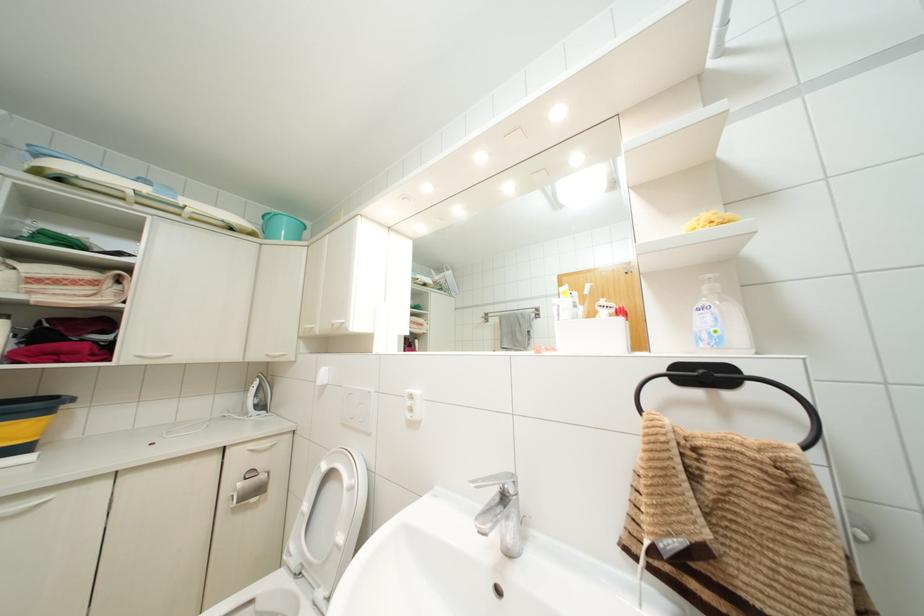
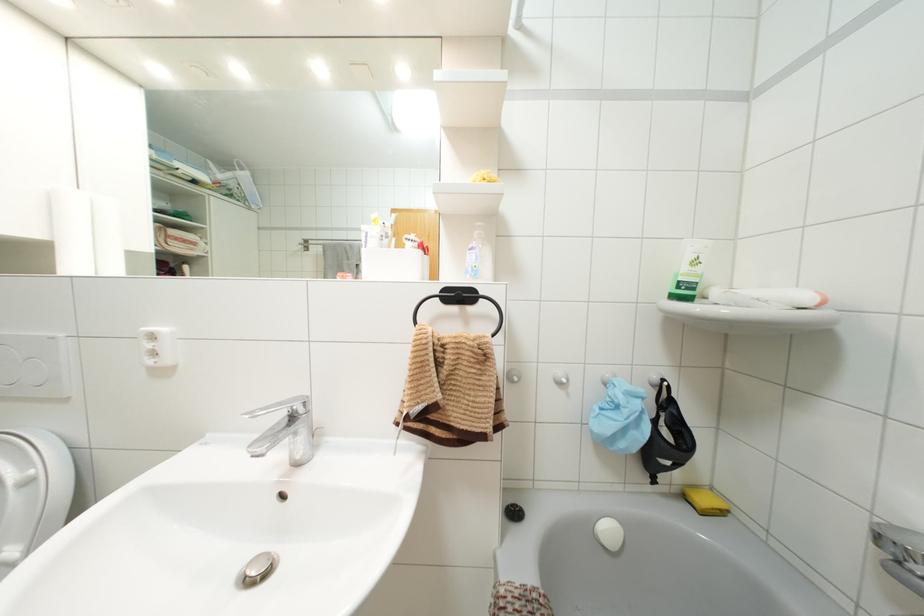
Find the pixel in the second image that matches pixel 511 490 in the first image.

(300, 410)